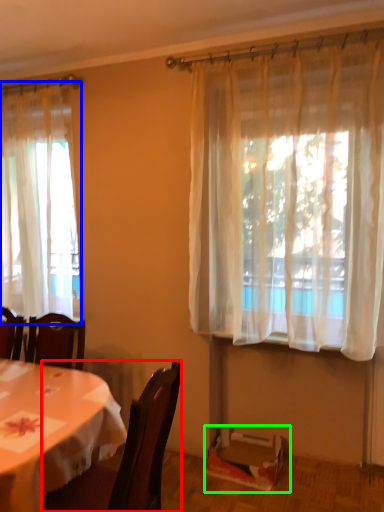
Question: Which is farther away from chair (highlighted by a red box)? curtain (highlighted by a blue box) or box (highlighted by a green box)?

Choices:
 (A) curtain
 (B) box

Answer: (A)